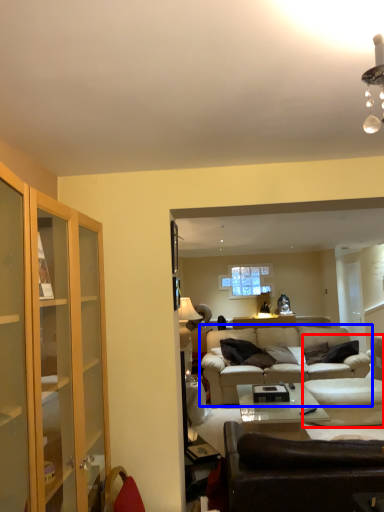
Question: Which of the following is the farthest to the observer, swivel chair (highlighted by a red box) or studio couch (highlighted by a blue box)?

Choices:
 (A) swivel chair
 (B) studio couch

Answer: (B)